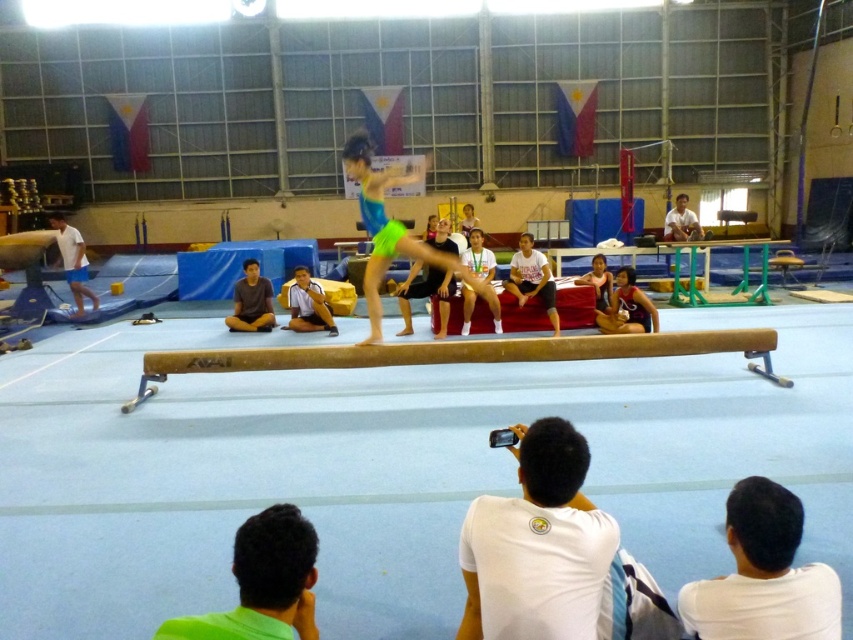
Which is in front, point (398, 349) or point (379, 269)?

Point (398, 349)

Does yellow matte balance beam at center have a greater width compared to neon green fabric gymnast at center?

Yes, yellow matte balance beam at center is wider than neon green fabric gymnast at center.

Is point (627, 339) farther from viewer compared to point (357, 156)?

Yes, point (627, 339) is farther from viewer.

Identify the location of yellow matte balance beam at center. The width and height of the screenshot is (853, 640). (469, 353).

Does white matte shirt at lower center have a larger size compared to green fabric shirt at lower left?

Indeed, white matte shirt at lower center has a larger size compared to green fabric shirt at lower left.

In the scene shown: Can you confirm if white matte shirt at lower center is positioned below green fabric shirt at lower left?

Incorrect, white matte shirt at lower center is not positioned below green fabric shirt at lower left.

I want to click on white matte shirt at lower center, so click(537, 545).

The image size is (853, 640). I want to click on white matte shirt at lower center, so click(x=537, y=545).

Which is more to the left, neon green fabric gymnast at center or white matte shorts at left?

white matte shorts at left

Does neon green fabric gymnast at center have a lesser height compared to white matte shorts at left?

No, neon green fabric gymnast at center is not shorter than white matte shorts at left.

Measure the distance between neon green fabric gymnast at center and camera.

neon green fabric gymnast at center is 5.65 meters away from camera.

Find the location of a particular element. neon green fabric gymnast at center is located at coordinates pyautogui.click(x=393, y=230).